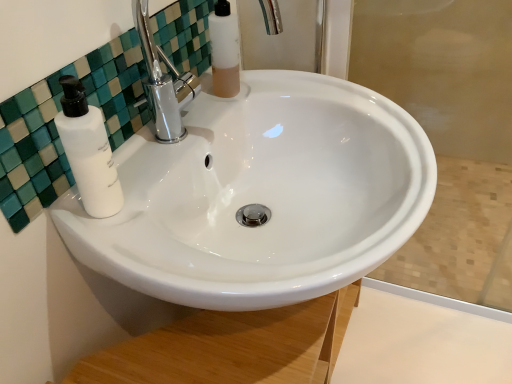
Question: Considering the positions of translucent plastic mouthwash at upper center and white glossy sink at center in the image, is translucent plastic mouthwash at upper center wider or thinner than white glossy sink at center?

Choices:
 (A) thin
 (B) wide

Answer: (A)

Question: Is translucent plastic mouthwash at upper center inside the boundaries of white glossy sink at center, or outside?

Choices:
 (A) inside
 (B) outside

Answer: (B)

Question: Considering the real-world distances, which object is closest to the translucent plastic mouthwash at upper center?

Choices:
 (A) white glossy sink at center
 (B) white matte soap dispenser at left
 (C) white glossy sink at upper center

Answer: (C)

Question: Which object is the farthest from the white glossy sink at center?

Choices:
 (A) translucent plastic mouthwash at upper center
 (B) white glossy sink at upper center
 (C) white matte soap dispenser at left

Answer: (C)